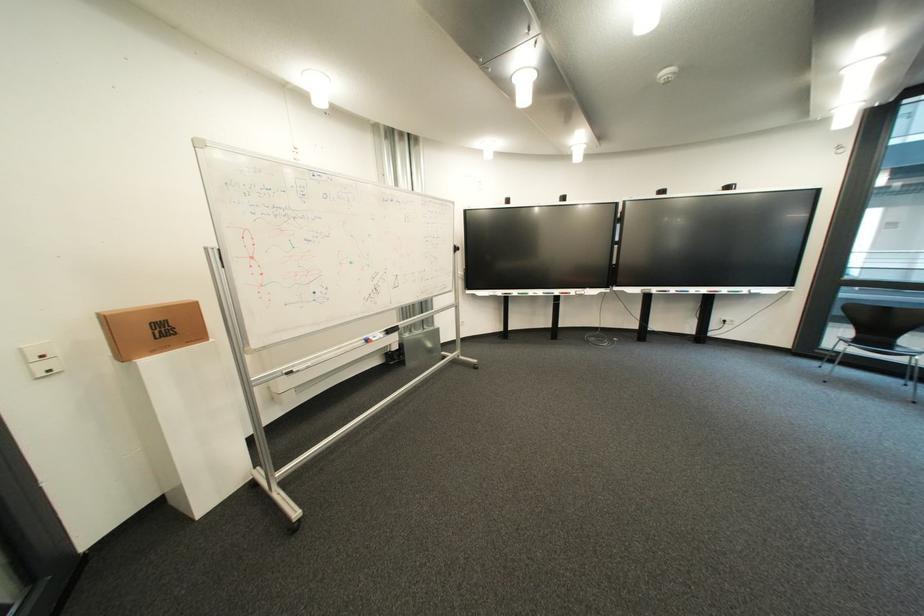
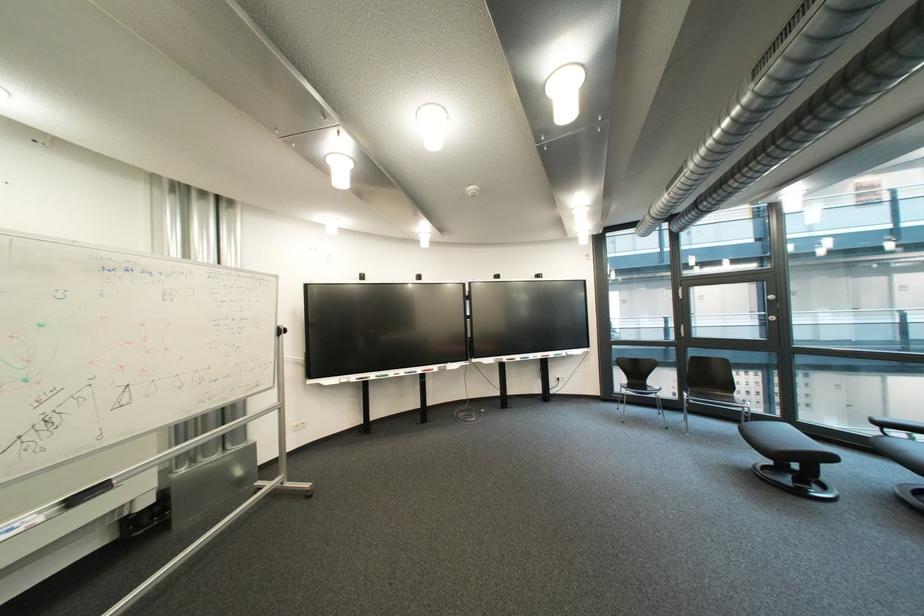
Which direction would the cameraman need to move to produce the second image?

The movement direction of the cameraman is right, forward.